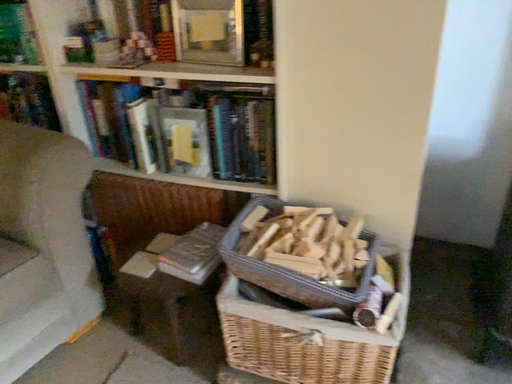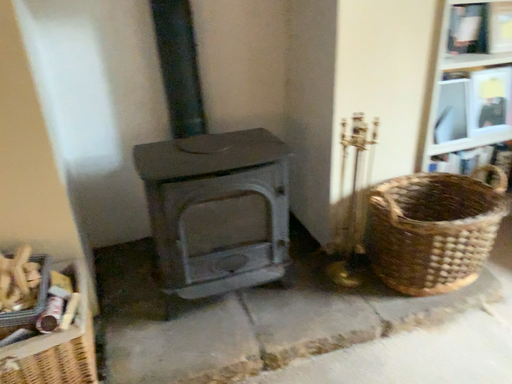
Question: How did the camera likely rotate when shooting the video?

Choices:
 (A) rotated right
 (B) rotated left

Answer: (A)